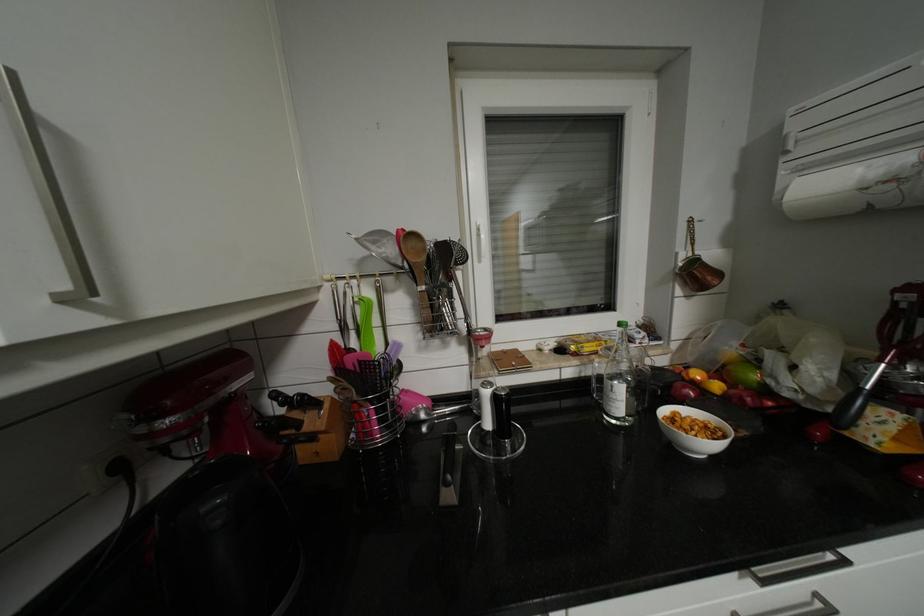
Identify the location of paper towel roll. The height and width of the screenshot is (616, 924). (857, 187).